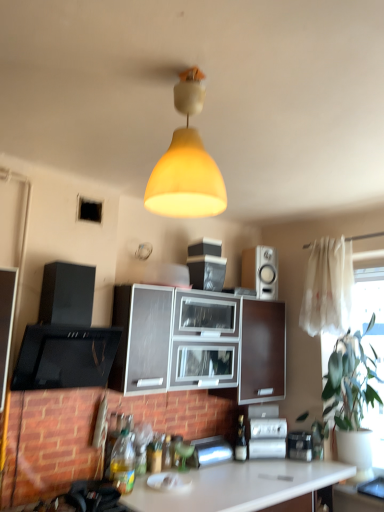
How much space does translucent glass bottle at center, placed as the third bottle when sorted from left to right, occupy vertically?

translucent glass bottle at center, placed as the third bottle when sorted from left to right, is 11.38 inches in height.

What do you see at coordinates (210, 452) in the screenshot? The image size is (384, 512). I see `metallic silver toaster at lower center, which is the 3th appliance from right to left` at bounding box center [210, 452].

What is the approximate width of green leafy plant at right?

green leafy plant at right is 28.17 inches wide.

What do you see at coordinates (240, 486) in the screenshot?
I see `white glossy countertop at lower center` at bounding box center [240, 486].

I want to click on translucent glass bottle at lower center, the 2th bottle when ordered from right to left, so click(x=155, y=453).

Describe the element at coordinates (155, 453) in the screenshot. I see `translucent glass bottle at lower center, which appears as the 2th bottle when viewed from the front` at that location.

Find the location of a particular element. translucent glass bottle at center, positioned as the first bottle in back-to-front order is located at coordinates (241, 441).

Which is more to the left, white glossy countertop at lower center or translucent glass bottle at lower center, which appears as the 2th bottle when viewed from the front?

translucent glass bottle at lower center, which appears as the 2th bottle when viewed from the front, is more to the left.

Is point (304, 480) closer or farther from the camera than point (155, 438)?

Point (304, 480) appears to be closer to the viewer than point (155, 438).

Considering the relative sizes of white glossy countertop at lower center and translucent glass bottle at lower center, acting as the 2th bottle starting from the left, in the image provided, is white glossy countertop at lower center wider than translucent glass bottle at lower center, acting as the 2th bottle starting from the left,?

Yes, white glossy countertop at lower center is wider than translucent glass bottle at lower center, acting as the 2th bottle starting from the left.

From the image's perspective, which one is positioned lower, metallic silver toaster at lower right, which is the first appliance in right-to-left order, or green leafy plant at right?

metallic silver toaster at lower right, which is the first appliance in right-to-left order, from the image's perspective.

Considering the sizes of objects metallic silver toaster at lower right, which is the first appliance in right-to-left order, and green leafy plant at right in the image provided, who is thinner, metallic silver toaster at lower right, which is the first appliance in right-to-left order, or green leafy plant at right?

Thinner between the two is metallic silver toaster at lower right, which is the first appliance in right-to-left order.

Between metallic silver toaster at lower right, which ranks as the 3th appliance in left-to-right order, and green leafy plant at right, which one has larger size?

With larger size is green leafy plant at right.

Is the position of metallic silver toaster at lower right, which ranks as the 3th appliance in left-to-right order, less distant than that of green leafy plant at right?

No, metallic silver toaster at lower right, which ranks as the 3th appliance in left-to-right order, is further to the viewer.

Could you tell me if white glossy speaker at upper right is facing white sheer curtain at right?

No, white glossy speaker at upper right is not facing towards white sheer curtain at right.

Looking at the image, does white glossy speaker at upper right seem bigger or smaller compared to white sheer curtain at right?

Clearly, white glossy speaker at upper right is smaller in size than white sheer curtain at right.

From the image's perspective, which one is positioned lower, white glossy speaker at upper right or white sheer curtain at right?

white sheer curtain at right is shown below in the image.

How many degrees apart are the facing directions of white sheer curtain at right and translucent plastic bottle at lower left, which is counted as the 3th bottle, starting from the back?

The angle between the facing direction of white sheer curtain at right and the facing direction of translucent plastic bottle at lower left, which is counted as the 3th bottle, starting from the back, is 88.7 degrees.

From the image's perspective, between white sheer curtain at right and translucent plastic bottle at lower left, which ranks as the first bottle in front-to-back order, which one is located above?

white sheer curtain at right.

In the image, is white sheer curtain at right on the left side or the right side of translucent plastic bottle at lower left, which ranks as the first bottle in front-to-back order?

In the image, white sheer curtain at right appears on the right side of translucent plastic bottle at lower left, which ranks as the first bottle in front-to-back order.

Is translucent plastic bottle at lower left, positioned as the first bottle in left-to-right order, a part of white sheer curtain at right?

No, translucent plastic bottle at lower left, positioned as the first bottle in left-to-right order, is not a part of white sheer curtain at right.

Measure the distance between metallic silver toaster at lower center, placed as the 1th appliance when sorted from left to right, and green leafy plant at right.

A distance of 35.55 inches exists between metallic silver toaster at lower center, placed as the 1th appliance when sorted from left to right, and green leafy plant at right.

Relative to green leafy plant at right, is metallic silver toaster at lower center, placed as the 1th appliance when sorted from left to right, in front or behind?

metallic silver toaster at lower center, placed as the 1th appliance when sorted from left to right, is positioned farther from the viewer than green leafy plant at right.

Are metallic silver toaster at lower center, placed as the 1th appliance when sorted from left to right, and green leafy plant at right located far from each other?

No, there isn't a large distance between metallic silver toaster at lower center, placed as the 1th appliance when sorted from left to right, and green leafy plant at right.

Is metallic silver toaster at lower center, which is the 3th appliance from right to left, at the right side of green leafy plant at right?

No, metallic silver toaster at lower center, which is the 3th appliance from right to left, is not to the right of green leafy plant at right.

Is green leafy plant at right thinner than white glossy countertop at lower center?

Indeed, green leafy plant at right has a lesser width compared to white glossy countertop at lower center.

Is green leafy plant at right inside the boundaries of white glossy countertop at lower center, or outside?

green leafy plant at right lies outside white glossy countertop at lower center.

Could you tell me if green leafy plant at right is turned towards white glossy countertop at lower center?

No.

Does translucent plastic bottle at lower left, the 3th bottle positioned from the right, turn towards metallic silver toaster at lower right, which is the first appliance in right-to-left order?

No, translucent plastic bottle at lower left, the 3th bottle positioned from the right, is not facing towards metallic silver toaster at lower right, which is the first appliance in right-to-left order.

Can you confirm if translucent plastic bottle at lower left, which is counted as the 3th bottle, starting from the back, is bigger than metallic silver toaster at lower right, which ranks as the 3th appliance in left-to-right order?

Incorrect, translucent plastic bottle at lower left, which is counted as the 3th bottle, starting from the back, is not larger than metallic silver toaster at lower right, which ranks as the 3th appliance in left-to-right order.

Is translucent plastic bottle at lower left, which is counted as the 3th bottle, starting from the back, inside or outside of metallic silver toaster at lower right, which ranks as the 3th appliance in left-to-right order?

translucent plastic bottle at lower left, which is counted as the 3th bottle, starting from the back, lies outside metallic silver toaster at lower right, which ranks as the 3th appliance in left-to-right order.

From a real-world perspective, count 1st appliances downward from the translucent plastic bottle at lower left, which is counted as the 3th bottle, starting from the back, and point to it. Please provide its 2D coordinates.

[(300, 445)]

At what (x,y) coordinates should I click in order to perform the action: click on the 1st bottle located above the white glossy countertop at lower center (from a real-world perspective). Please return your answer as a coordinate pair (x, y). The image size is (384, 512). Looking at the image, I should click on (155, 453).

Image resolution: width=384 pixels, height=512 pixels. In order to click on the 2nd appliance behind when counting from the green leafy plant at right in this screenshot , I will do `click(300, 445)`.

Based on the photo, looking at the image, which one is located further to metallic silver toaster at lower right, which is the first appliance in right-to-left order, translucent plastic bottle at lower left, positioned as the first bottle in left-to-right order, or white glossy speaker at upper right?

translucent plastic bottle at lower left, positioned as the first bottle in left-to-right order, lies further to metallic silver toaster at lower right, which is the first appliance in right-to-left order, than the other object.

From the image, which object appears to be nearer to metallic silver toaster at lower right, which ranks as the 3th appliance in left-to-right order, white sheer curtain at right or yellow matte lampshade at center?

white sheer curtain at right.

Considering their positions, is white sheer curtain at right positioned closer to satin silver appliance at lower center, which appears as the second appliance when viewed from the right, than yellow matte lampshade at center?

white sheer curtain at right is closer to satin silver appliance at lower center, which appears as the second appliance when viewed from the right.

Considering their positions, is translucent glass bottle at center, positioned as the third bottle in front-to-back order, positioned further to green leafy plant at right than satin silver appliance at lower center, which appears as the second appliance when viewed from the right?

translucent glass bottle at center, positioned as the third bottle in front-to-back order.

From the image, which object appears to be nearer to yellow matte lampshade at center, translucent plastic bottle at lower left, positioned as the first bottle in left-to-right order, or metallic silver toaster at lower right, which ranks as the 3th appliance in left-to-right order?

Based on the image, translucent plastic bottle at lower left, positioned as the first bottle in left-to-right order, appears to be nearer to yellow matte lampshade at center.

When comparing their distances from white glossy countertop at lower center, does white sheer curtain at right or white glossy speaker at upper right seem closer?

white sheer curtain at right lies closer to white glossy countertop at lower center than the other object.

When comparing their distances from translucent glass bottle at center, positioned as the third bottle in front-to-back order, does white glossy speaker at upper right or matte gray cabinet at center seem further?

white glossy speaker at upper right is positioned further to the anchor translucent glass bottle at center, positioned as the third bottle in front-to-back order.

Looking at the image, which one is located further to metallic silver toaster at lower right, which is the first appliance in right-to-left order, translucent glass bottle at lower center, which is the second bottle in back-to-front order, or white glossy speaker at upper right?

Among the two, white glossy speaker at upper right is located further to metallic silver toaster at lower right, which is the first appliance in right-to-left order.

The width and height of the screenshot is (384, 512). In order to click on cabinetry that lies between white glossy speaker at upper right and white glossy countertop at lower center from top to bottom in this screenshot , I will do `click(198, 343)`.

Locate an element on the screen. houseplant between white sheer curtain at right and metallic silver toaster at lower center, placed as the 1th appliance when sorted from left to right, vertically is located at coordinates (351, 397).

Find the location of a particular element. Image resolution: width=384 pixels, height=512 pixels. countertop located between matte gray cabinet at center and green leafy plant at right in the left-right direction is located at coordinates (240, 486).

You are a GUI agent. You are given a task and a screenshot of the screen. Output one action in this format:
    pyautogui.click(x=<x>, y=<y>)
    Task: Click on the bottle situated between translucent glass bottle at lower center, which is the second bottle in back-to-front order, and white sheer curtain at right from left to right
    
    Given the screenshot: What is the action you would take?
    pyautogui.click(x=241, y=441)